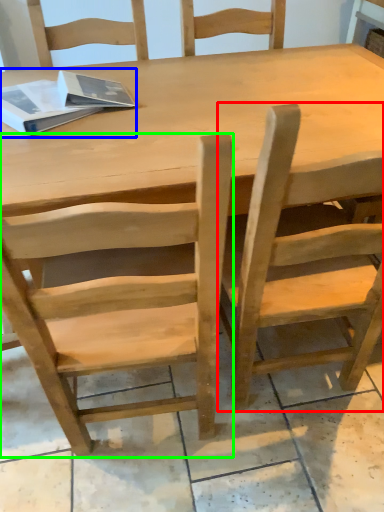
Question: Which object is positioned closest to chair (highlighted by a red box)? Select from book (highlighted by a blue box) and chair (highlighted by a green box).

Choices:
 (A) book
 (B) chair

Answer: (B)